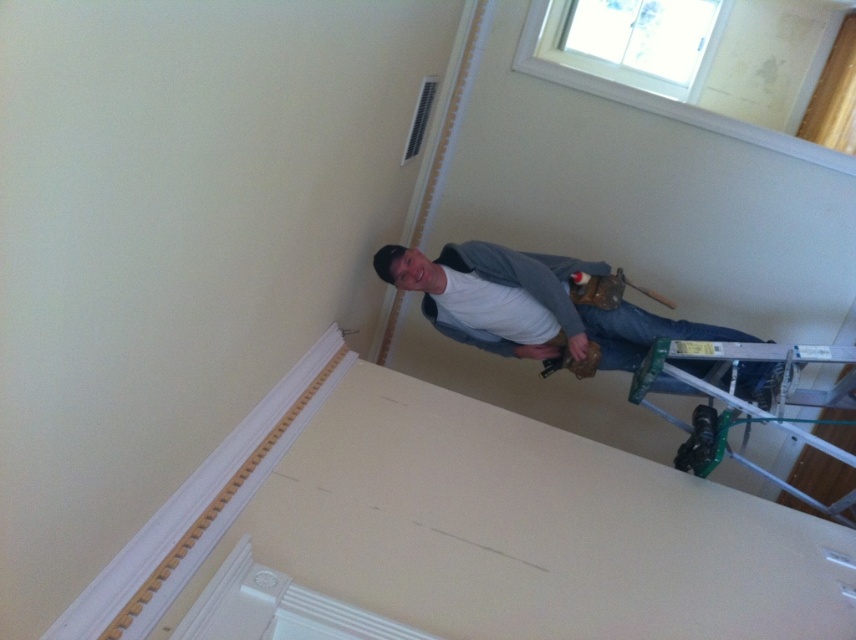
Question: Observing the image, what is the correct spatial positioning of gray fabric shirt at upper right in reference to silver metallic ladder at lower right?

Choices:
 (A) left
 (B) right

Answer: (A)

Question: Observing the image, what is the correct spatial positioning of gray fabric shirt at upper right in reference to silver metallic ladder at lower right?

Choices:
 (A) left
 (B) right

Answer: (A)

Question: Which of the following is the farthest from the observer?

Choices:
 (A) gray fabric shirt at upper right
 (B) silver metallic ladder at lower right

Answer: (A)

Question: Is gray fabric shirt at upper right above silver metallic ladder at lower right?

Choices:
 (A) yes
 (B) no

Answer: (A)